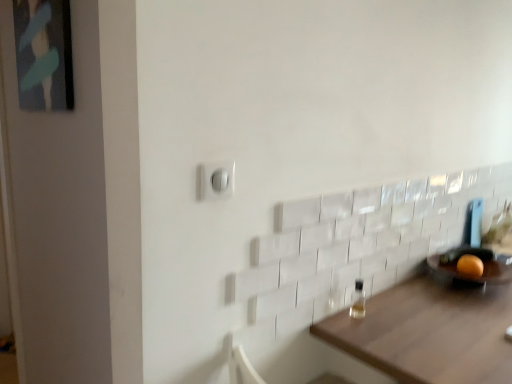
This screenshot has height=384, width=512. What are the coordinates of `free location in front of transparent glass bottle at lower right` in the screenshot? It's located at (379, 339).